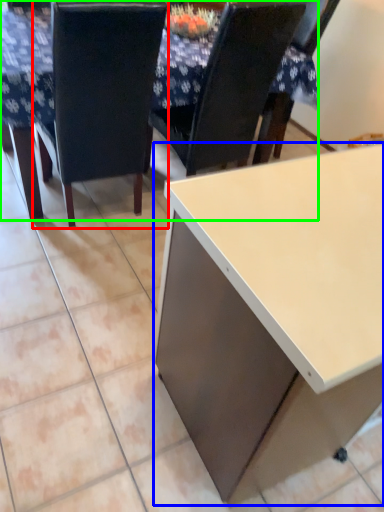
Question: Which object is the farthest from chair (highlighted by a red box)? Choose among these: desk (highlighted by a blue box) or table (highlighted by a green box).

Choices:
 (A) desk
 (B) table

Answer: (A)